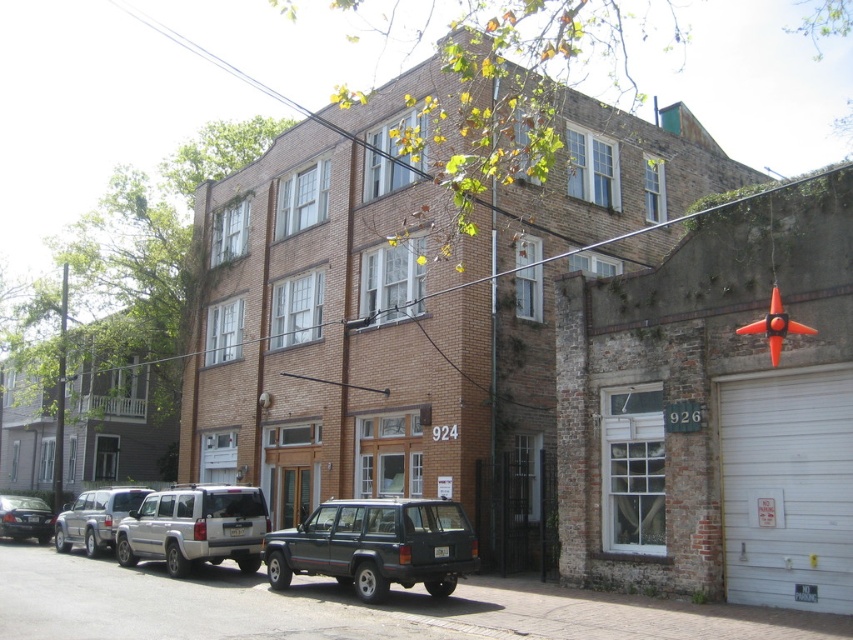
You are a delivery driver who needs to park your vehicle between the silver metallic suv at center and the matte black sedan at lower left. Which vehicle should you position your car closer to if you want to maximize the available space for your delivery van?

You should position your delivery van closer to the matte black sedan at lower left because the silver metallic suv at center is larger, leaving less space between them. By parking near the smaller matte black sedan at lower left, you can utilize the wider gap created by the size difference.

You are standing in front of the building and want to park your car. The parking spot is marked by point (376, 545). What is the color of the vehicle currently occupying that spot?

The point (376, 545) marks a dark gray matte SUV at center, so the vehicle occupying that spot is dark gray in color.

You are a pedestrian standing on the sidewalk in front of the three story brick building. You see a silver metallic suv at lower left and a silver metallic suv at center. Which SUV is closer to the ground floor entrance?

The silver metallic suv at center is closer to the ground floor entrance because it is positioned below the silver metallic suv at lower left, which is higher up.